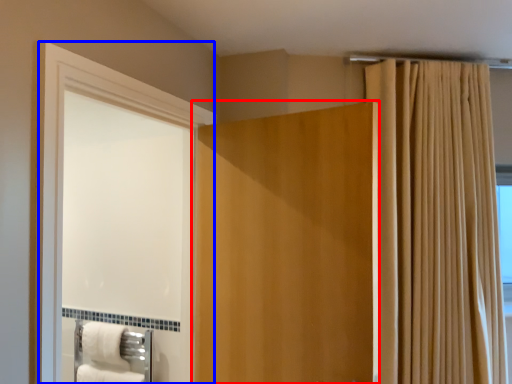
Question: Which of the following is the closest to the observer, door (highlighted by a red box) or screen door (highlighted by a blue box)?

Choices:
 (A) door
 (B) screen door

Answer: (B)